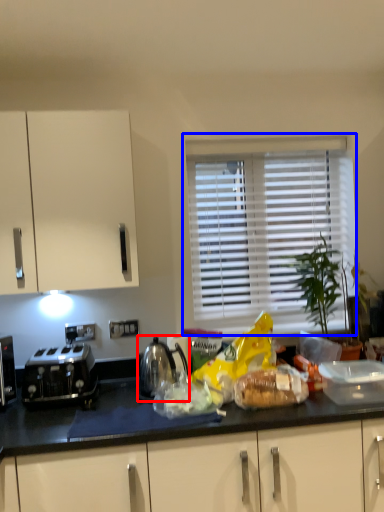
Question: Which of the following is the farthest to the observer, kettle (highlighted by a red box) or window (highlighted by a blue box)?

Choices:
 (A) kettle
 (B) window

Answer: (B)